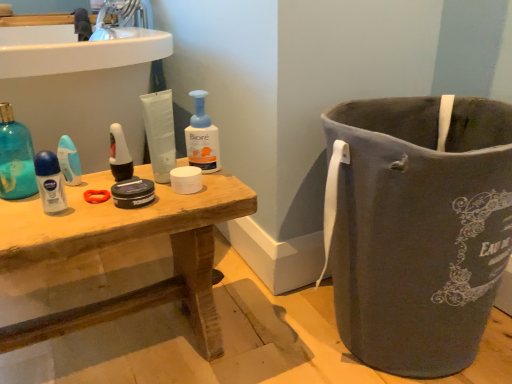
Find the location of a particular element. This screenshot has height=384, width=512. free space in front of translucent plastic pump bottle at center, the 1th cleaning product from the right is located at coordinates (181, 192).